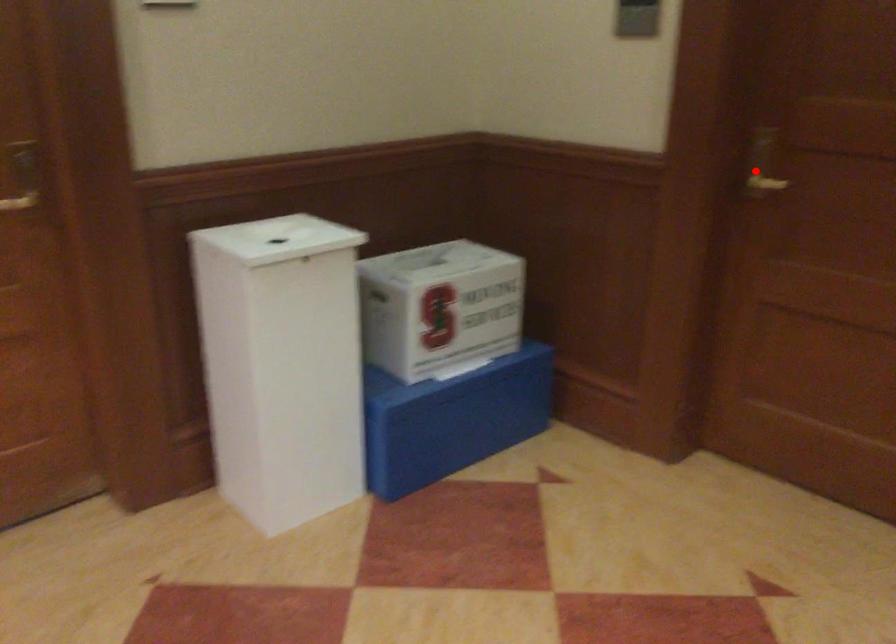
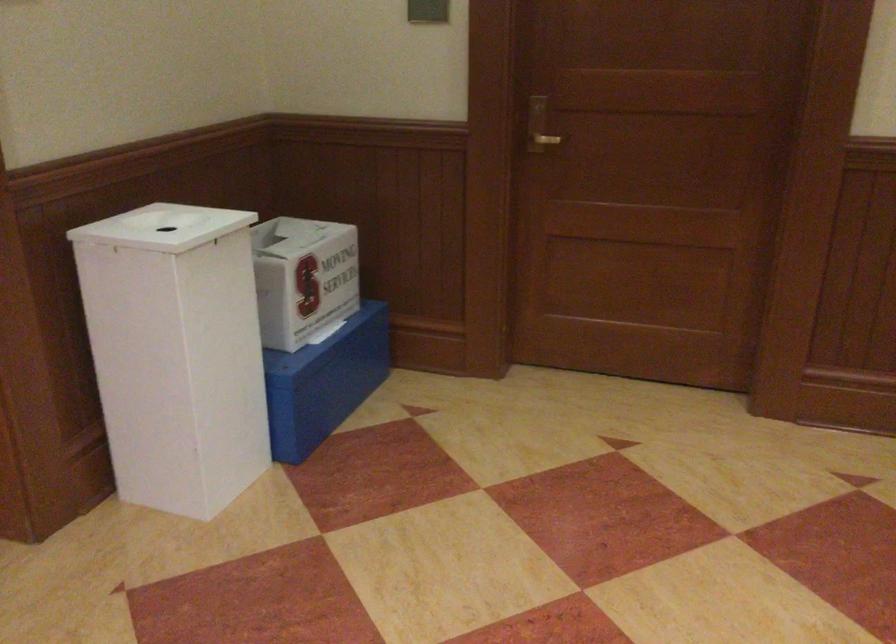
Question: I am providing you with two images of the same scene from different viewpoints. A red point is shown in image1. For the corresponding object point in image2, is it positioned nearer or farther from the camera?

Choices:
 (A) Nearer
 (B) Farther

Answer: (B)